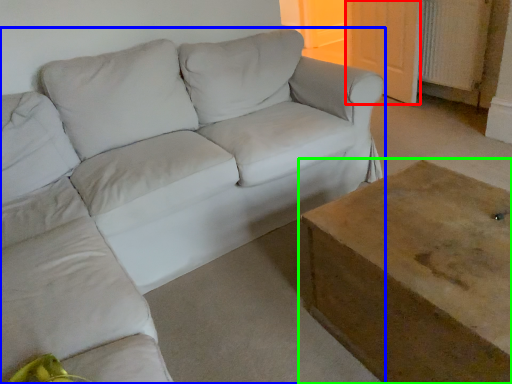
Question: Considering the real-world distances, which object is closest to door (highlighted by a red box)? studio couch (highlighted by a blue box) or table (highlighted by a green box).

Choices:
 (A) studio couch
 (B) table

Answer: (A)